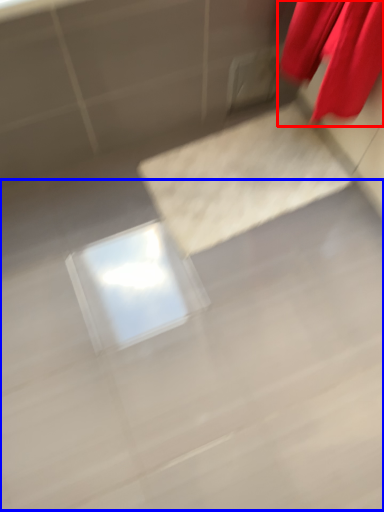
Question: Which object is further to the camera taking this photo, curtain (highlighted by a red box) or concrete (highlighted by a blue box)?

Choices:
 (A) curtain
 (B) concrete

Answer: (B)